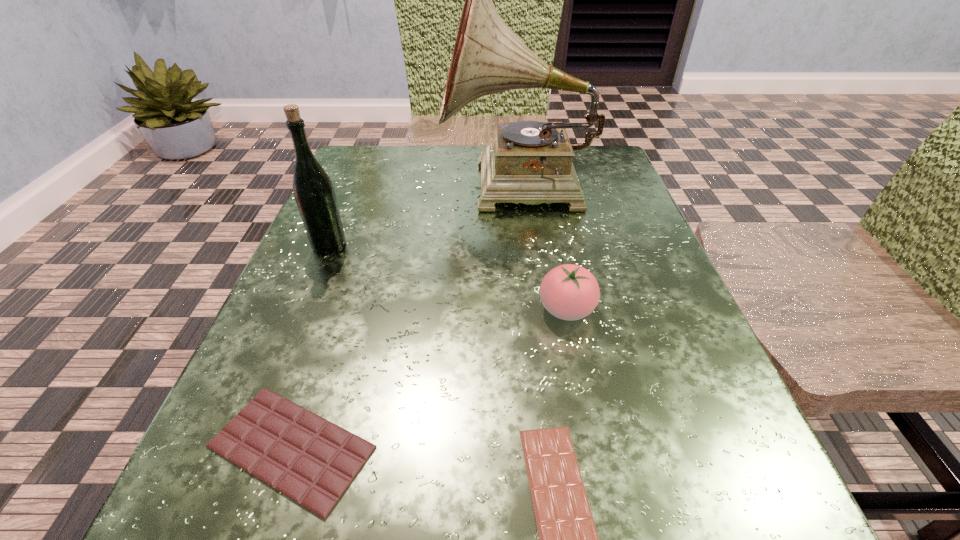
Locate an element on the screen. The image size is (960, 540). free space between the tallest object and the second farthest object is located at coordinates point(423,217).

Identify the location of free area in between the record player and the taller chocolate bar. Image resolution: width=960 pixels, height=540 pixels. (405, 318).

Where is `free spot between the record player and the fourth shortest object`? free spot between the record player and the fourth shortest object is located at coordinates (423, 217).

Locate an element on the screen. vacant space that's between the tallest object and the fourth nearest object is located at coordinates tap(423, 217).

Find the location of `vacant area that lies between the left chocolate bar and the beer bottle`. vacant area that lies between the left chocolate bar and the beer bottle is located at coordinates (310, 347).

Locate an element on the screen. unoccupied area between the tallest object and the third farthest object is located at coordinates (542, 249).

At what (x,y) coordinates should I click in order to perform the action: click on object that ranks as the fourth closest to the tomato. Please return your answer as a coordinate pair (x, y). The image size is (960, 540). Looking at the image, I should click on (314, 193).

Locate an element on the screen. object identified as the fourth closest to the left chocolate bar is located at coordinates (530, 162).